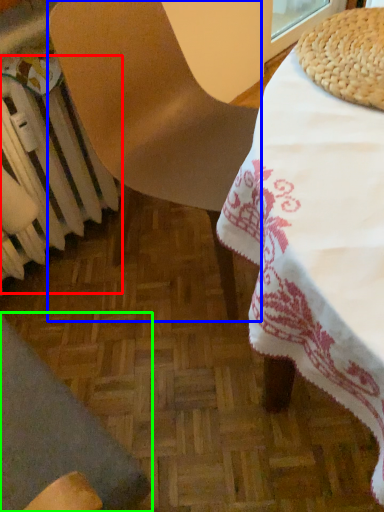
Question: Which object is the closest to the radiator (highlighted by a red box)? Choose among these: chair (highlighted by a blue box) or chair (highlighted by a green box).

Choices:
 (A) chair
 (B) chair

Answer: (A)